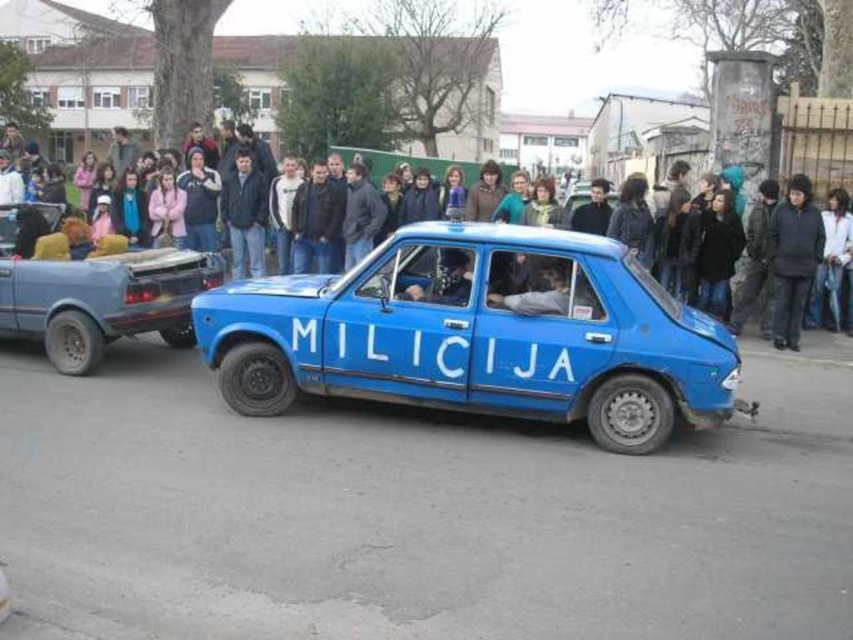
You are a pedestrian standing at the point with coordinates (479, 333). What object are you standing on?

You are standing on the blue matte car at center located at point (479, 333).

You are a photographer at the scene and want to capture both the blue matte car at center and the rusty metal pickup truck at left in a single photo. Which object should you position closer to the camera to ensure both are fully visible in the frame?

To ensure both the blue matte car at center and the rusty metal pickup truck at left are fully visible in the frame, you should position the blue matte car at center closer to the camera. Since the blue matte car at center is below the rusty metal pickup truck at left, moving it forward will allow both objects to fit within the photo without one being cropped out.

You are a photographer trying to capture a photo of the rusty metal pickup truck at left and the dark blue clothing at center. Which object should you focus on first if you want to ensure both are in the frame without moving the camera?

The rusty metal pickup truck at left is shorter than the dark blue clothing at center, so you should focus on the dark blue clothing at center first to ensure both are in the frame.